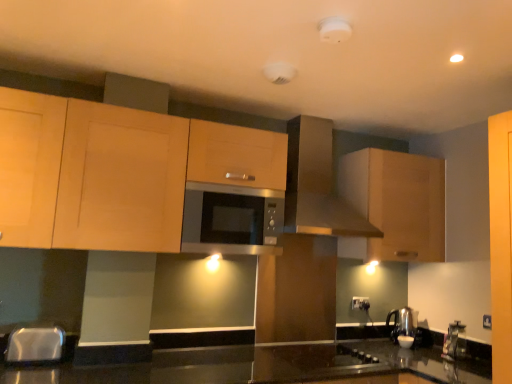
Question: Is light wood cabinet at upper center, the second cabinetry positioned from the right, inside the boundaries of matte brown range hood at upper center, or outside?

Choices:
 (A) outside
 (B) inside

Answer: (A)

Question: From the image's perspective, is light wood cabinet at upper center, which is the first cabinetry from left to right, positioned above or below matte brown range hood at upper center?

Choices:
 (A) above
 (B) below

Answer: (B)

Question: Estimate the real-world distances between objects in this image. Which object is farther from the satin silver microwave at center?

Choices:
 (A) light wood cabinet at upper center, which is the first cabinetry from left to right
 (B) metallic stainless steel sink at lower left
 (C) matte brown range hood at upper center
 (D) white plastic electric outlet at center
 (E) white glossy kettle at lower right

Answer: (E)

Question: Which object is the closest to the matte brown range hood at upper center?

Choices:
 (A) metallic stainless steel sink at lower left
 (B) white plastic electric outlet at center
 (C) light wood cabinet at upper center, which is the first cabinetry from left to right
 (D) satin silver microwave at center
 (E) white glossy kettle at lower right

Answer: (D)